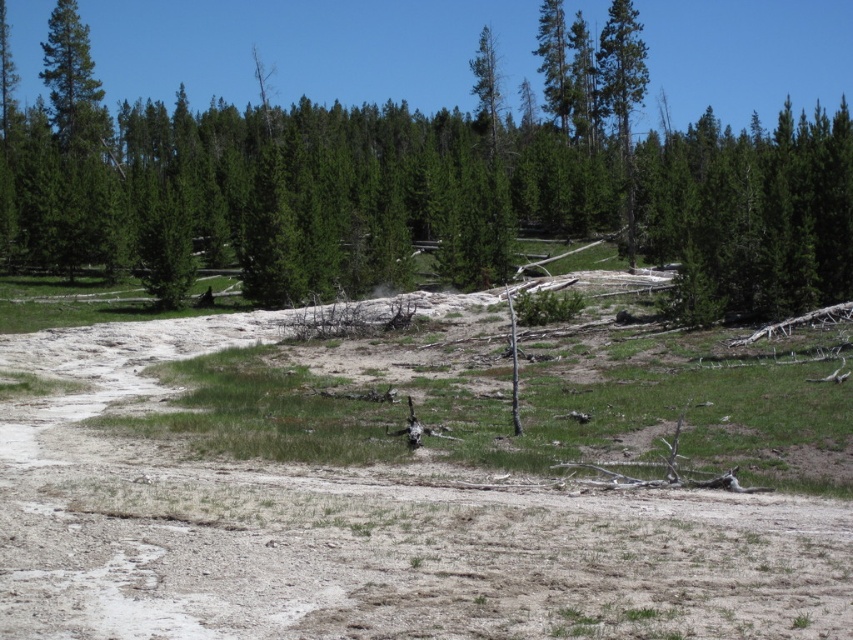
You are standing at the edge of a natural landscape and see the green matte tree at center and the dull brown dirt field at center. Which object is positioned to the left when facing the scene?

The green matte tree at center is positioned to the left of the dull brown dirt field at center.

You are a hiker who needs to cross from the green matte tree at center to the dull brown dirt field at center. Given that your average walking pace is 1.4 meters per second, how many seconds will it take you to walk directly between them?

The distance between the green matte tree at center and the dull brown dirt field at center is 72.88 meters. At a pace of 1.4 meters per second, it would take approximately 52.06 seconds to walk directly between them.

Based on the photo, you are standing at point (630, 35) and want to walk to point (219, 164). Is the destination point behind you or in front of you?

The destination point (219, 164) is behind you because it is located behind point (630, 35) where you are standing.